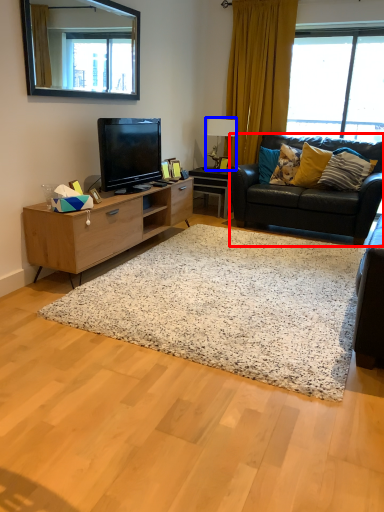
Question: Among these objects, which one is farthest to the camera, studio couch (highlighted by a red box) or lamp (highlighted by a blue box)?

Choices:
 (A) studio couch
 (B) lamp

Answer: (B)